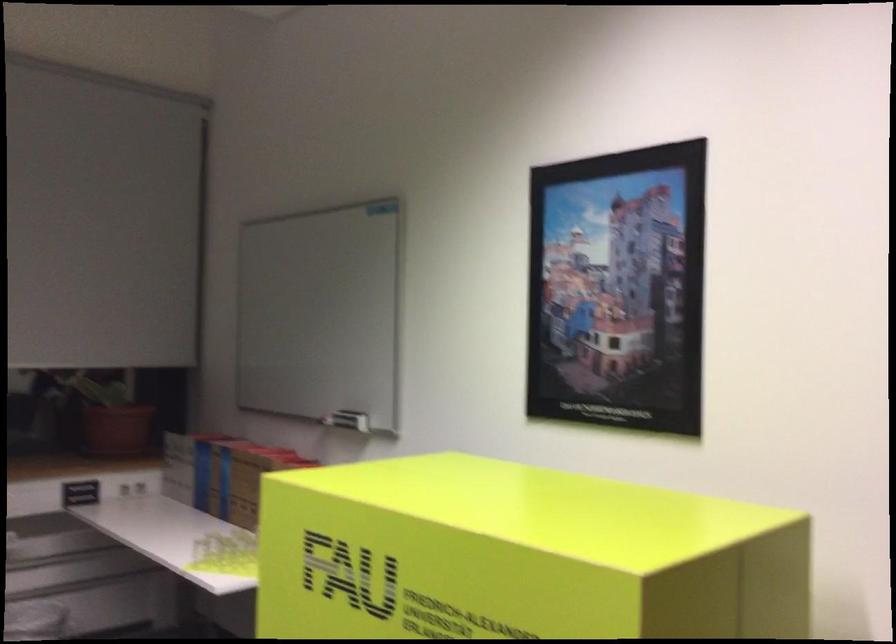
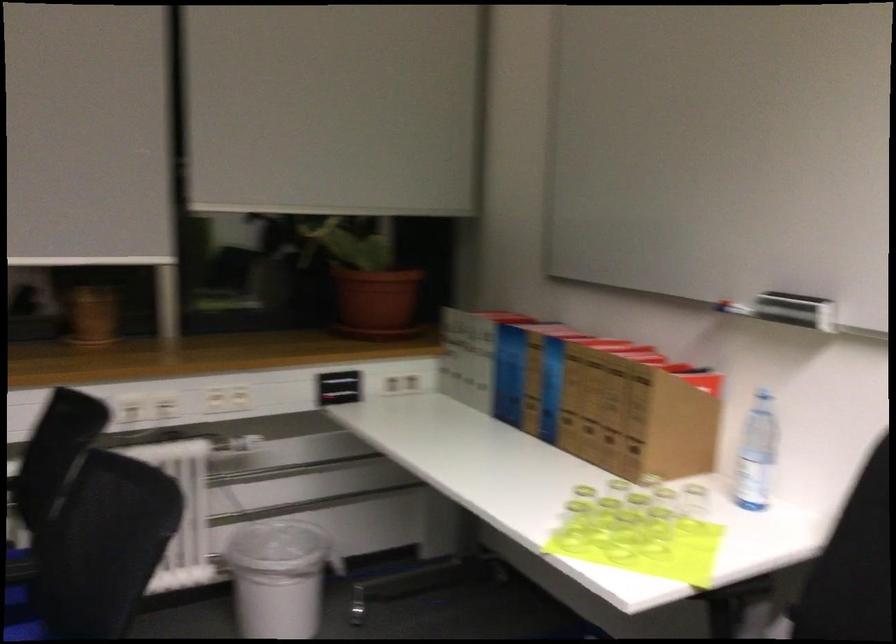
Where in the second image is the point corresponding to [352,415] from the first image?

(795, 310)